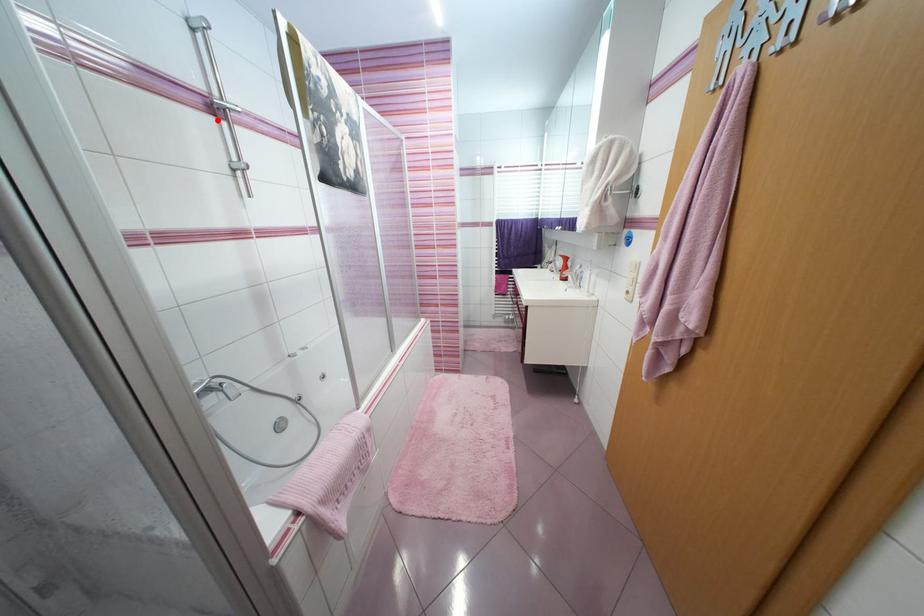
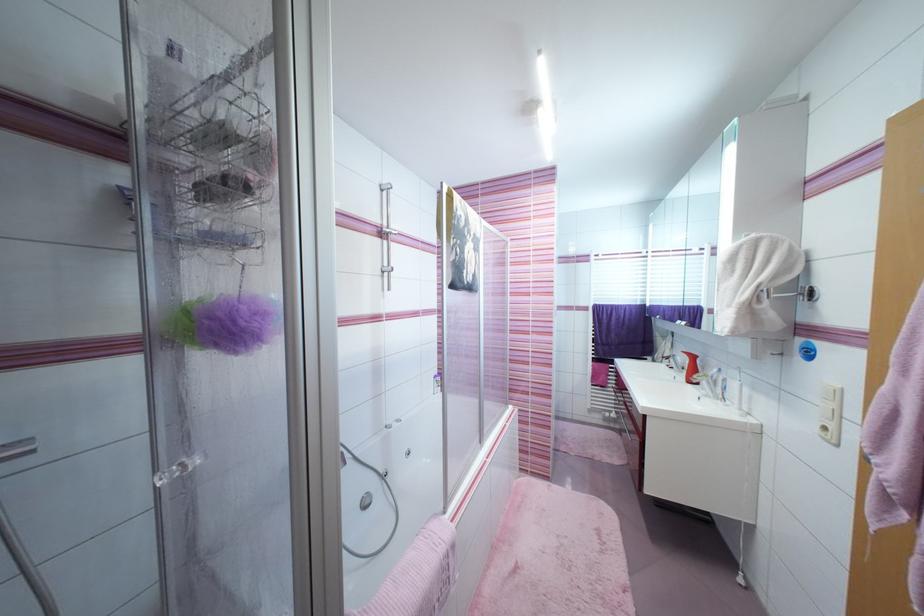
In the second image, find the point that corresponds to the highlighted location in the first image.

(383, 241)